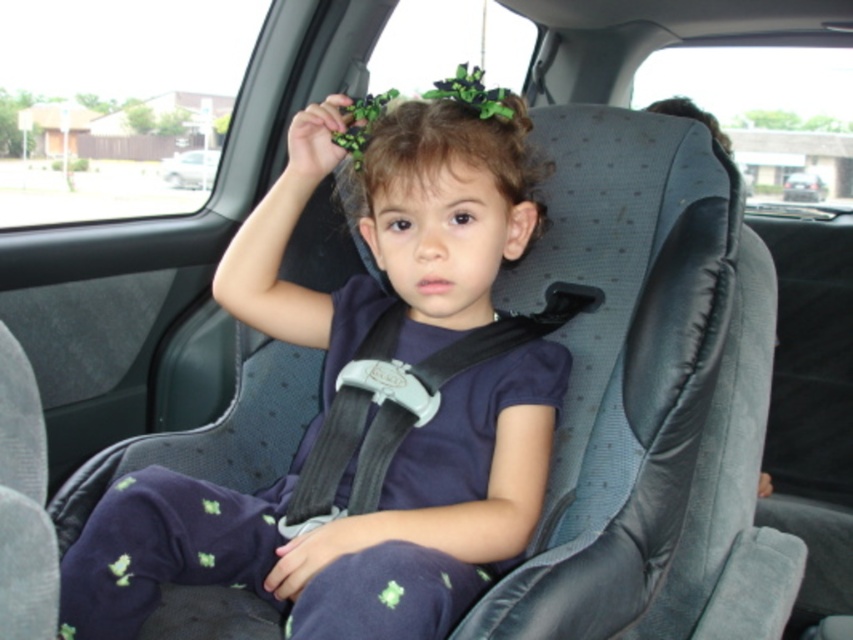
Question: Is dark brown hair at center below dark brown curly hair at upper center?

Choices:
 (A) no
 (B) yes

Answer: (B)

Question: Is dark brown hair at center below dark brown curly hair at upper center?

Choices:
 (A) no
 (B) yes

Answer: (B)

Question: Which point is closer to the camera?

Choices:
 (A) (384, 132)
 (B) (302, 525)
 (C) (737, 368)

Answer: (B)

Question: Is matte black car seat at center to the left of dark brown curly hair at upper center from the viewer's perspective?

Choices:
 (A) no
 (B) yes

Answer: (B)

Question: Which point is closer to the camera taking this photo?

Choices:
 (A) (527, 182)
 (B) (392, 385)

Answer: (B)

Question: Which of the following is the farthest from the observer?

Choices:
 (A) black fabric seatbelt at center
 (B) matte black car seat at center
 (C) dark brown hair at center

Answer: (C)